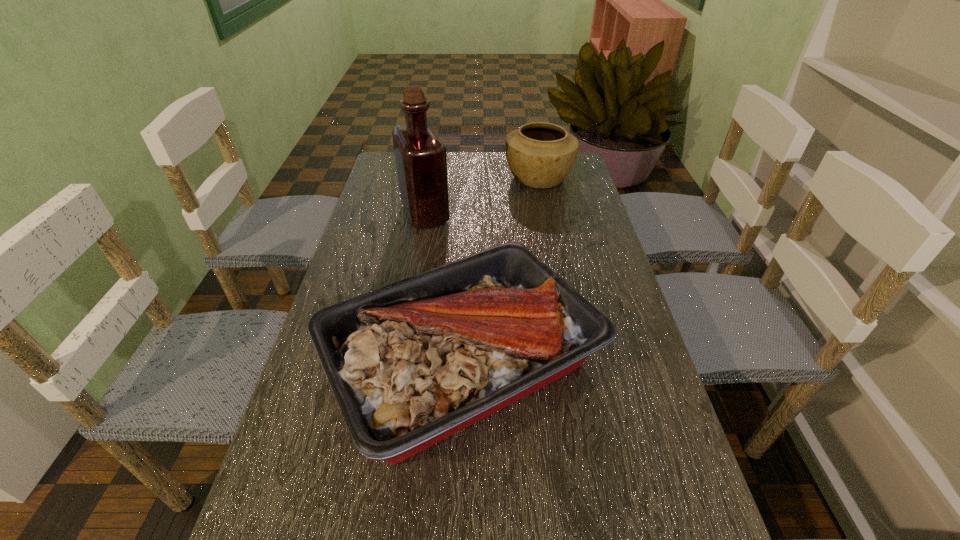
Identify the location of vacant space that satisfies the following two spatial constraints: 1. on the back side of the farthest object; 2. on the left side of the second farthest object. The height and width of the screenshot is (540, 960). (431, 178).